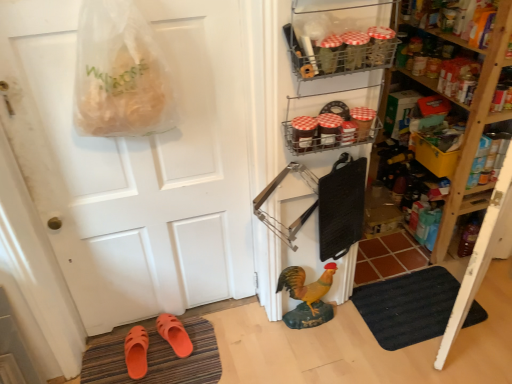
The height and width of the screenshot is (384, 512). I want to click on vacant space underneath black rubber doormat at lower right, placed as the 2th doormat when sorted from left to right (from a real-world perspective), so click(x=413, y=305).